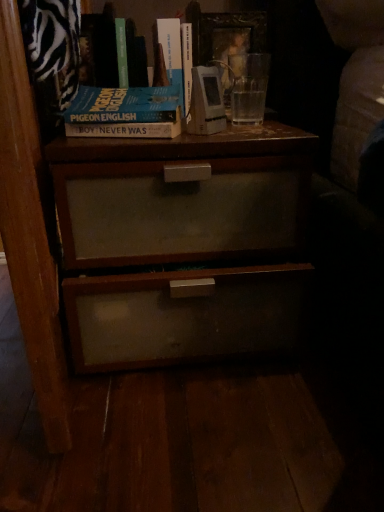
I want to click on vacant area that is in front of blue matte book at upper center, so click(x=123, y=141).